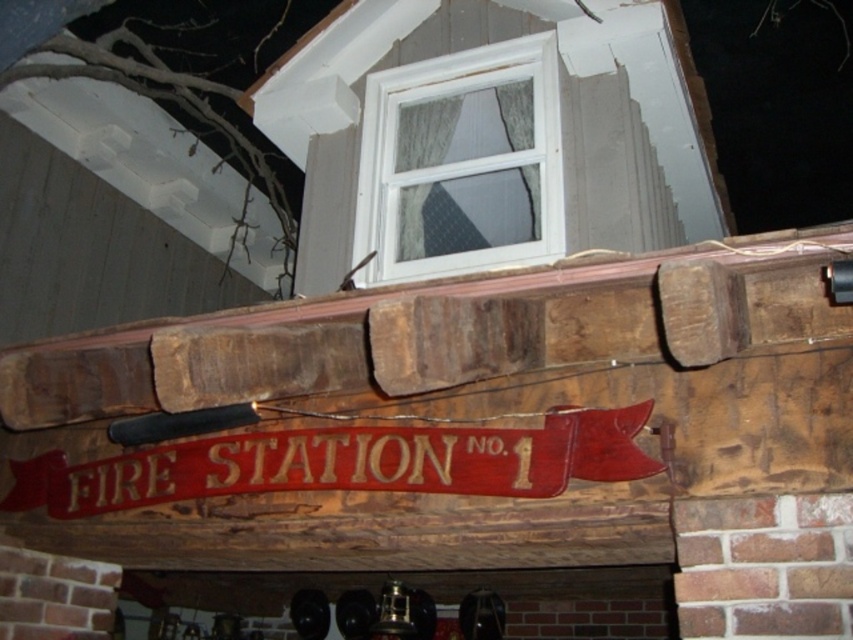
Based on the photo, you are a firefighter checking the building structure. You see the rustic wood beam at center and the white plastic window at upper center. Which object is located to the left of the other?

The rustic wood beam at center is positioned on the left side of white plastic window at upper center.

You are a firefighter who needs to hang a new emergency light. The light requires 3.5 feet of space between it and the nearest object. Can you safely install the light between the rustic wood beam at center and the white plastic window at upper center?

The rustic wood beam at center is 4.08 feet from the white plastic window at upper center. Since the required space is 3.5 feet, the distance is sufficient, so the light can be safely installed between them.